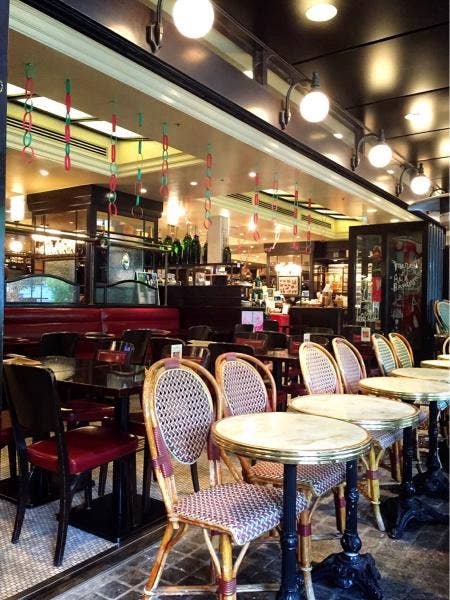
Identify the location of chairs in first row. The width and height of the screenshot is (450, 600). (183, 416), (234, 386), (315, 364), (354, 359), (383, 354), (400, 344), (443, 314).